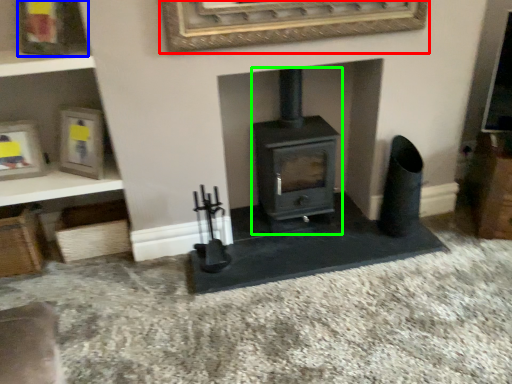
Question: Considering the real-world distances, which object is closest to picture frame (highlighted by a red box)? picture frame (highlighted by a blue box) or wood burning stove (highlighted by a green box).

Choices:
 (A) picture frame
 (B) wood burning stove

Answer: (B)